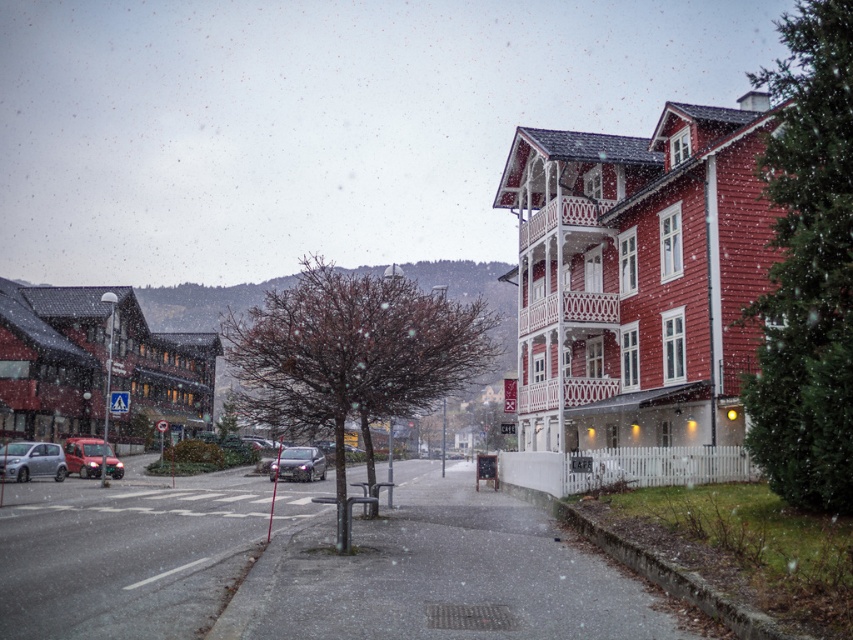
Question: Which point is closer to the camera?

Choices:
 (A) (44, 451)
 (B) (607, 378)
 (C) (289, 472)

Answer: (B)

Question: Does matte red wooden house at right have a greater width compared to satin silver car at center?

Choices:
 (A) no
 (B) yes

Answer: (B)

Question: Which point is closer to the camera?

Choices:
 (A) satin silver car at lower left
 (B) matte red building at left
 (C) satin silver car at center
 (D) matte red wooden house at right

Answer: (D)

Question: Is the position of matte red wooden house at right more distant than that of satin silver car at lower left?

Choices:
 (A) no
 (B) yes

Answer: (A)

Question: Which point is farther to the camera?

Choices:
 (A) (41, 465)
 (B) (80, 285)

Answer: (B)

Question: Is matte red building at left to the right of satin silver car at lower left from the viewer's perspective?

Choices:
 (A) yes
 (B) no

Answer: (B)